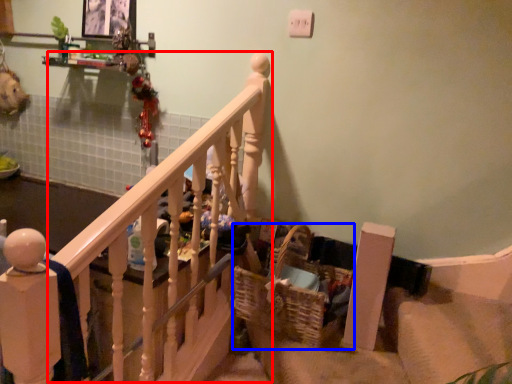
Question: Which object appears farthest to the camera in this image, rail (highlighted by a red box) or basket (highlighted by a blue box)?

Choices:
 (A) rail
 (B) basket

Answer: (B)